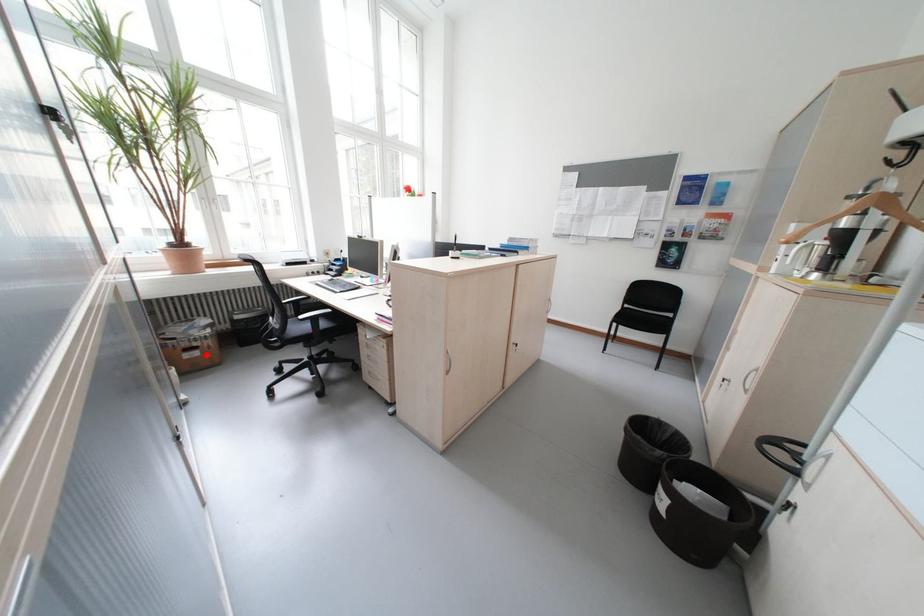
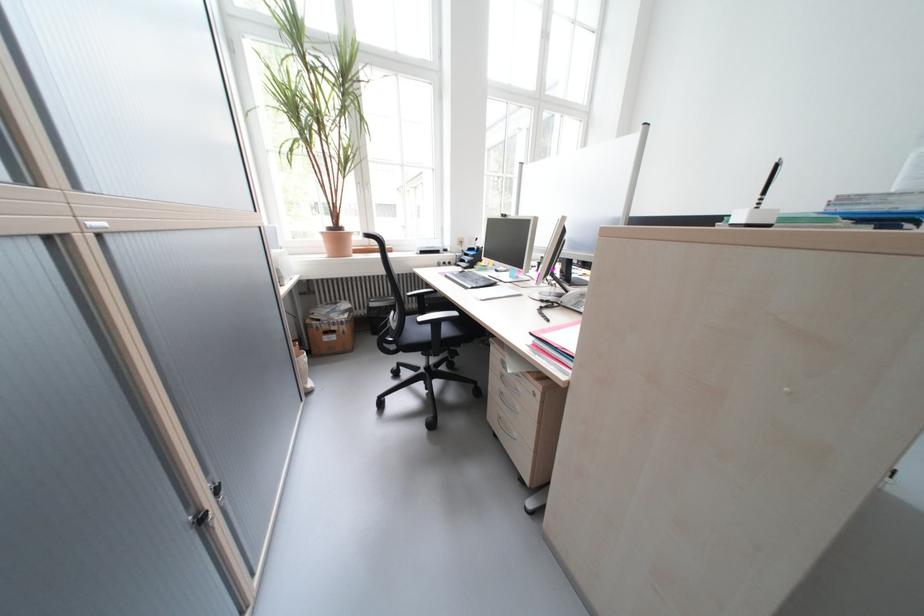
Find the pixel in the second image that matches the highlighted location in the first image.

(344, 339)